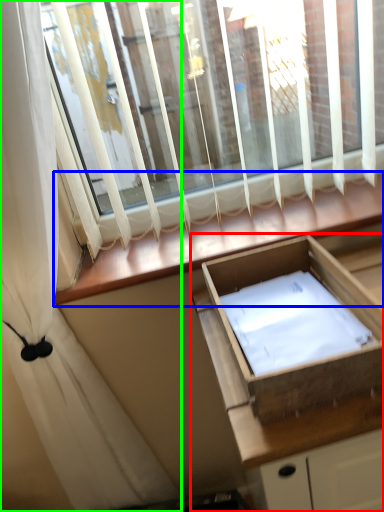
Question: Based on their relative distances, which object is nearer to cabinetry (highlighted by a red box)? Choose from window sill (highlighted by a blue box) and curtain (highlighted by a green box).

Choices:
 (A) window sill
 (B) curtain

Answer: (A)